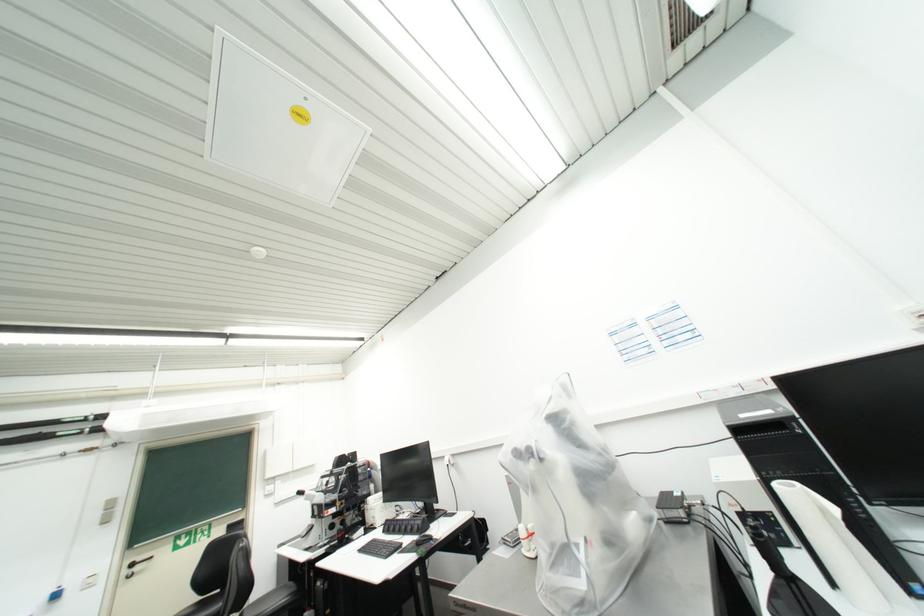
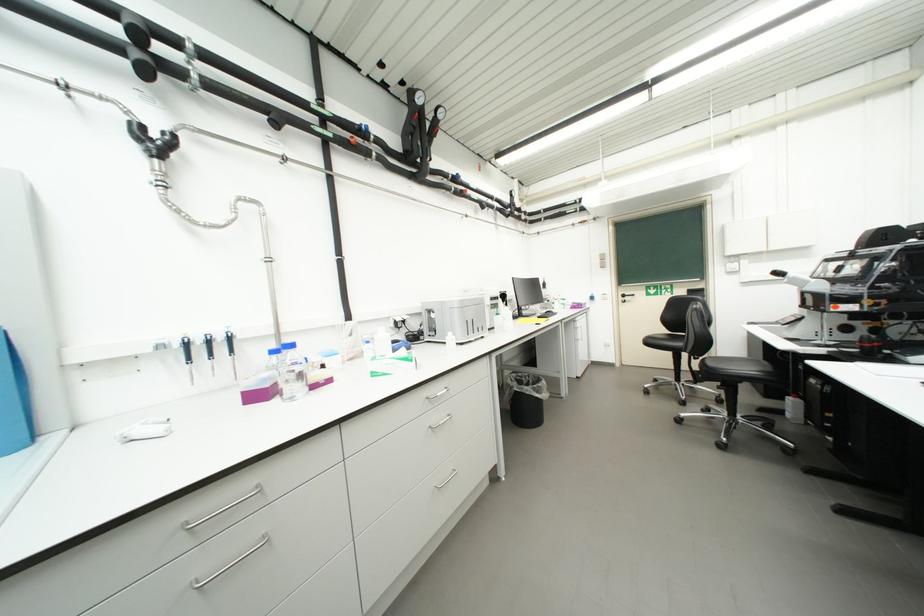
First-person continuous shooting, in which direction is the camera rotating?

The camera rotated toward left-down.